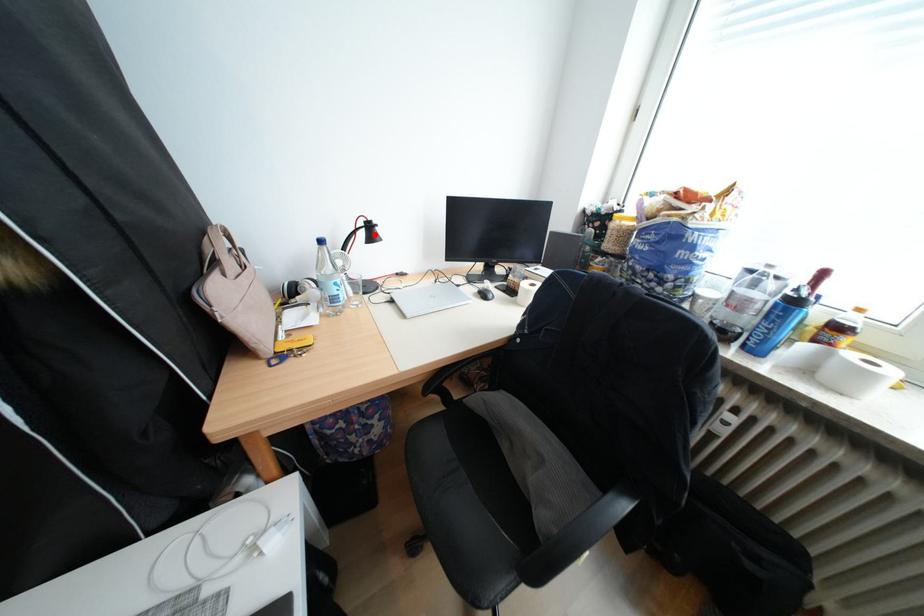
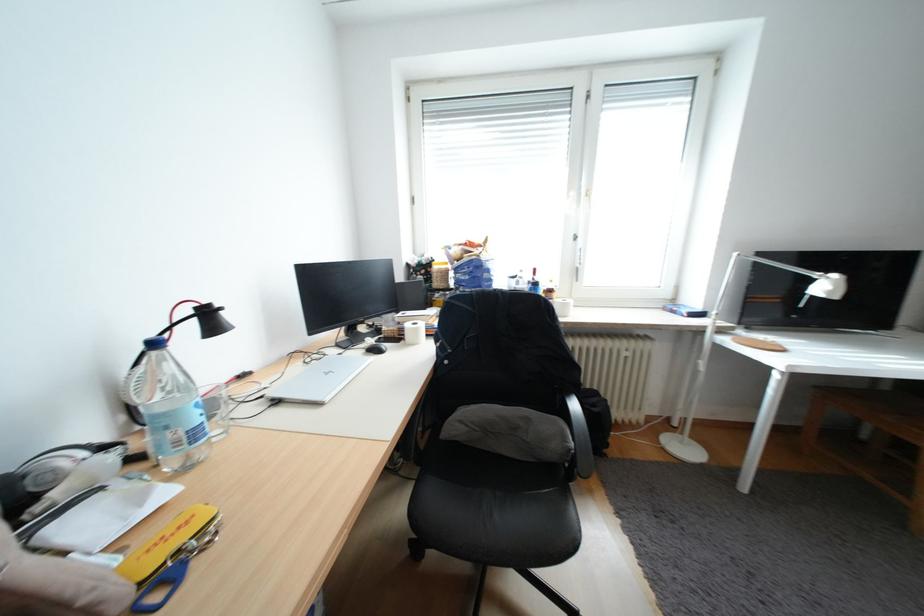
Where in the second image is the point corresponding to the highlighted location from the first image?

(202, 328)